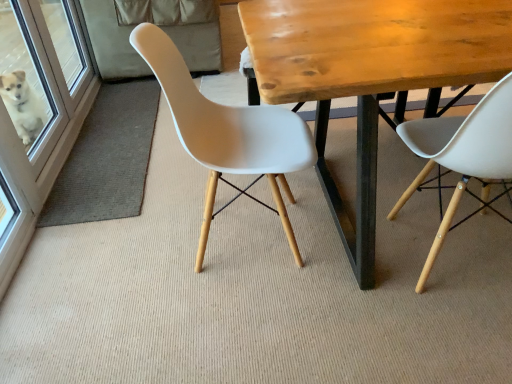
Question: Considering the relative positions of white plastic chair at center, the second chair viewed from the right, and white glossy screen door at left in the image provided, is white plastic chair at center, the second chair viewed from the right, behind white glossy screen door at left?

Choices:
 (A) no
 (B) yes

Answer: (A)

Question: Is white plastic chair at center, the second chair viewed from the right, wider than white glossy screen door at left?

Choices:
 (A) yes
 (B) no

Answer: (A)

Question: Is white plastic chair at center, the 1th chair positioned from the left, looking in the opposite direction of white glossy screen door at left?

Choices:
 (A) no
 (B) yes

Answer: (A)

Question: Does white plastic chair at center, the second chair viewed from the right, have a larger size compared to white glossy screen door at left?

Choices:
 (A) no
 (B) yes

Answer: (B)

Question: Can you confirm if white plastic chair at center, the 1th chair positioned from the left, is positioned to the left of white glossy screen door at left?

Choices:
 (A) yes
 (B) no

Answer: (B)

Question: Do you think wooden table at center is within white plastic chair at center, the 1th chair positioned from the left, or outside of it?

Choices:
 (A) outside
 (B) inside

Answer: (A)

Question: Considering the positions of wooden table at center and white plastic chair at center, the second chair viewed from the right, in the image, is wooden table at center wider or thinner than white plastic chair at center, the second chair viewed from the right,?

Choices:
 (A) thin
 (B) wide

Answer: (B)

Question: Visually, is wooden table at center positioned to the left or to the right of white plastic chair at center, the 1th chair positioned from the left?

Choices:
 (A) left
 (B) right

Answer: (B)

Question: Considering the positions of point (367, 163) and point (216, 105), is point (367, 163) closer or farther from the camera than point (216, 105)?

Choices:
 (A) closer
 (B) farther

Answer: (A)

Question: Is wooden table at center wider or thinner than white glossy screen door at left?

Choices:
 (A) thin
 (B) wide

Answer: (B)

Question: Is point (476, 28) positioned closer to the camera than point (45, 185)?

Choices:
 (A) farther
 (B) closer

Answer: (B)

Question: From a real-world perspective, is wooden table at center positioned above or below white glossy screen door at left?

Choices:
 (A) below
 (B) above

Answer: (A)

Question: Is wooden table at center spatially inside white glossy screen door at left, or outside of it?

Choices:
 (A) outside
 (B) inside

Answer: (A)

Question: From the image's perspective, is white plastic chair at right, the second chair in the left-to-right sequence, above or below white plastic chair at center, the second chair viewed from the right?

Choices:
 (A) above
 (B) below

Answer: (B)

Question: In terms of width, does white plastic chair at right, the second chair in the left-to-right sequence, look wider or thinner when compared to white plastic chair at center, the 1th chair positioned from the left?

Choices:
 (A) wide
 (B) thin

Answer: (B)